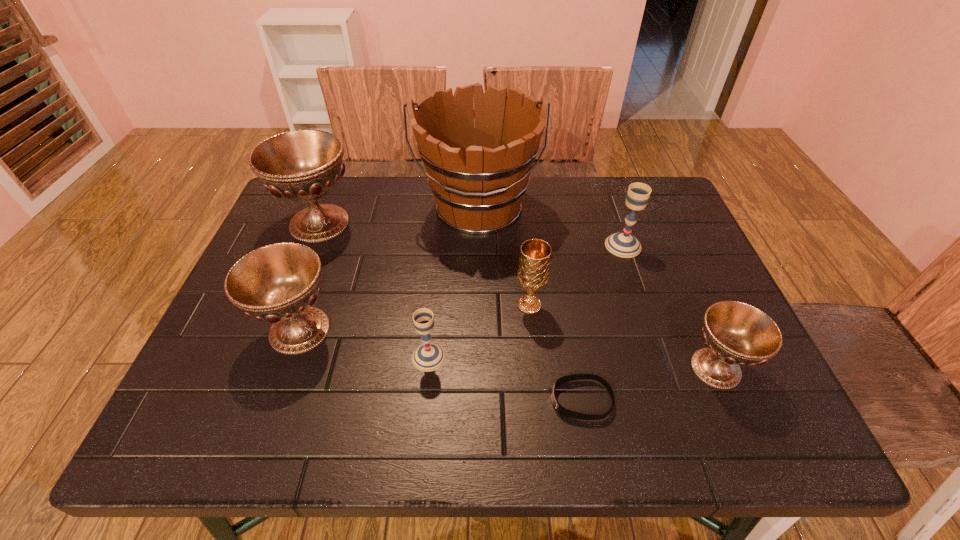
Locate an element on the screen. object identified as the third closest to the smallest red chalice is located at coordinates (533, 269).

Locate an element on the screen. This screenshot has width=960, height=540. chalice that is the sixth closest to the wine bucket is located at coordinates (737, 334).

Find the location of a particular element. The image size is (960, 540). chalice that stands as the fourth closest to the rightmost red chalice is located at coordinates (279, 283).

Identify which red chalice is the second closest to the third chalice from left to right. Please provide its 2D coordinates. Your answer should be formatted as a tuple, i.e. [(x, y)], where the tuple contains the x and y coordinates of a point satisfying the conditions above.

[(303, 165)]

You are a GUI agent. You are given a task and a screenshot of the screen. Output one action in this format:
    pyautogui.click(x=<x>, y=<y>)
    Task: Click on the red chalice that stands as the closest to the smallest red chalice
    
    Given the screenshot: What is the action you would take?
    pyautogui.click(x=279, y=283)

Identify the location of vacant point that satisfies the following two spatial constraints: 1. on the front side of the rightmost red chalice; 2. on the right side of the right gray chalice. This screenshot has height=540, width=960. (664, 368).

Find the location of a particular element. The image size is (960, 540). vacant region that satisfies the following two spatial constraints: 1. with the handle on the wine bucket; 2. on the right side of the bigger gray chalice is located at coordinates (477, 246).

Where is `vacant region that satisfies the following two spatial constraints: 1. with the handle on the wine bucket; 2. on the left side of the third chalice from right to left`? vacant region that satisfies the following two spatial constraints: 1. with the handle on the wine bucket; 2. on the left side of the third chalice from right to left is located at coordinates (477, 305).